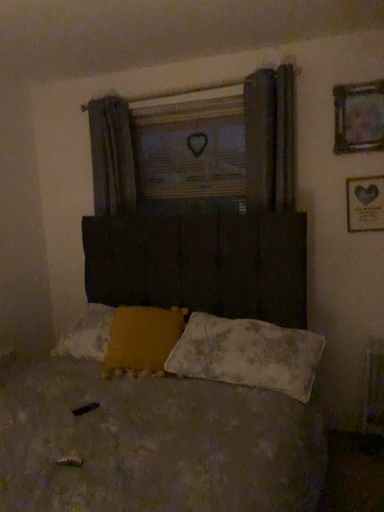
Question: Should I look upward or downward to see worn fabric pillow at lower center, arranged as the 2th pillow when viewed from the left?

Choices:
 (A) down
 (B) up

Answer: (A)

Question: From a real-world perspective, is worn fabric bed at center under yellow fuzzy pillow at lower center, positioned as the 2th pillow in right-to-left order?

Choices:
 (A) no
 (B) yes

Answer: (B)

Question: From a real-world perspective, is worn fabric bed at center physically above yellow fuzzy pillow at lower center, positioned as the 2th pillow in right-to-left order?

Choices:
 (A) yes
 (B) no

Answer: (B)

Question: Does worn fabric bed at center lie in front of yellow fuzzy pillow at lower center, positioned as the 2th pillow in right-to-left order?

Choices:
 (A) yes
 (B) no

Answer: (A)

Question: Could you tell me if worn fabric bed at center is turned towards yellow fuzzy pillow at lower center, which is the first pillow from left to right?

Choices:
 (A) no
 (B) yes

Answer: (A)

Question: Can you confirm if worn fabric bed at center is positioned to the right of yellow fuzzy pillow at lower center, positioned as the 2th pillow in right-to-left order?

Choices:
 (A) yes
 (B) no

Answer: (B)

Question: From the image's perspective, is worn fabric bed at center below yellow fuzzy pillow at lower center, which is the first pillow from left to right?

Choices:
 (A) no
 (B) yes

Answer: (B)

Question: Is wooden heart at center smaller than gold metallic picture frame at upper right, which is the 2th picture frame in top-to-bottom order?

Choices:
 (A) yes
 (B) no

Answer: (B)

Question: Is wooden heart at center far from gold metallic picture frame at upper right, the 1th picture frame positioned from the bottom?

Choices:
 (A) no
 (B) yes

Answer: (B)

Question: Does wooden heart at center turn towards gold metallic picture frame at upper right, the 1th picture frame positioned from the bottom?

Choices:
 (A) no
 (B) yes

Answer: (A)

Question: From the image's perspective, does wooden heart at center appear lower than gold metallic picture frame at upper right, which is the 2th picture frame in top-to-bottom order?

Choices:
 (A) no
 (B) yes

Answer: (A)

Question: Does wooden heart at center come behind gold metallic picture frame at upper right, the 1th picture frame positioned from the bottom?

Choices:
 (A) yes
 (B) no

Answer: (A)

Question: From a real-world perspective, is wooden heart at center positioned under gold metallic picture frame at upper right, which is the 2th picture frame in top-to-bottom order, based on gravity?

Choices:
 (A) yes
 (B) no

Answer: (B)

Question: Is worn fabric bed at center positioned behind wooden heart at center?

Choices:
 (A) no
 (B) yes

Answer: (A)